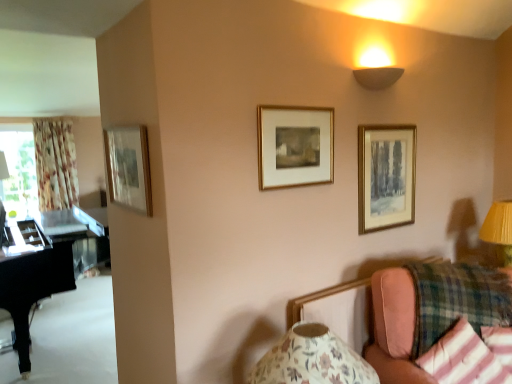
Question: From a real-world perspective, is striped cotton pillow at lower right, positioned as the first pillow in left-to-right order, positioned above or below gold wooden picture frame at center, the 2th picture frame positioned from the right?

Choices:
 (A) above
 (B) below

Answer: (B)

Question: From the image's perspective, is striped cotton pillow at lower right, positioned as the first pillow in left-to-right order, positioned above or below gold wooden picture frame at center, the 2th picture frame positioned from the right?

Choices:
 (A) above
 (B) below

Answer: (B)

Question: Estimate the real-world distances between objects in this image. Which object is farther from the striped cotton pillow at lower right, positioned as the first pillow in left-to-right order?

Choices:
 (A) pink fabric couch at lower right
 (B) matte beige wall sconce at upper right
 (C) gold wooden picture frame at center, the second picture frame in the left-to-right sequence
 (D) black polished piano at left
 (E) floral fabric curtain at left

Answer: (E)

Question: Which object is positioned farthest from the floral paper lampshade at lower right, acting as the 1th table lamp starting from the front?

Choices:
 (A) pink fabric couch at lower right
 (B) matte beige wall sconce at upper right
 (C) gold-framed mirror at upper left, arranged as the 3th picture frame when viewed from the right
 (D) gold wooden picture frame at center, the second picture frame in the left-to-right sequence
 (E) gold-framed painting at upper right, positioned as the first picture frame in right-to-left order

Answer: (B)